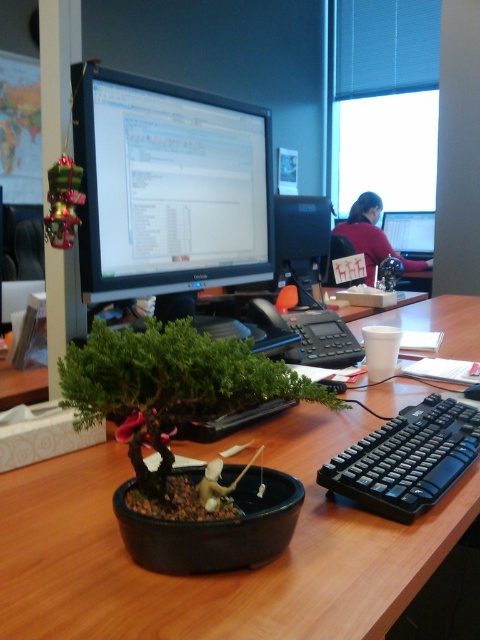
You are organizing the desk items and need to place a new keyboard that is 15 cm wide. The new keyboard must be placed between the two matte black monitors. Can the space between the matte black monitor at center and the matte black monitor at upper center accommodate the new keyboard?

The matte black monitor at center is narrower than the matte black monitor at upper center. However, the description only provides information about their widths, not the distance between them. Without knowing the actual space between the monitors, it is impossible to determine if the 15 cm keyboard will fit.

You are organizing items on your desk and want to place a new pen holder. The pen holder will be placed at point (168, 188). Which object currently occupies this location?

The matte black monitor at center is located at point (168, 188).

Consider the image. You are setting up a new monitor in your office. You want to place it exactly where the matte black monitor at center is currently located. According to the coordinates provided, what are the coordinates where you should place your new monitor?

The coordinates for the matte black monitor at center are at point (168, 188). You should place your new monitor at those coordinates.